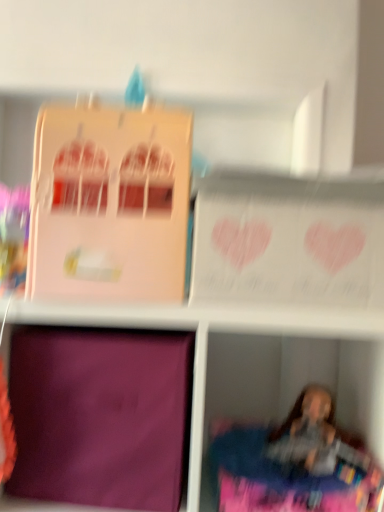
Where is `purple fabric at lower left`? This screenshot has width=384, height=512. purple fabric at lower left is located at coordinates (254, 360).

Measure the distance between purple matte cardboard box at lower left, the 1th cardboard box from the bottom, and camera.

purple matte cardboard box at lower left, the 1th cardboard box from the bottom, and camera are 29.09 inches apart from each other.

Identify the location of purple fabric at lower left. This screenshot has width=384, height=512. (254, 360).

Considering the sizes of purple fabric at lower left and purple matte cardboard box at lower left, the 2th cardboard box when ordered from top to bottom, in the image, is purple fabric at lower left taller or shorter than purple matte cardboard box at lower left, the 2th cardboard box when ordered from top to bottom,?

In the image, purple fabric at lower left appears to be taller than purple matte cardboard box at lower left, the 2th cardboard box when ordered from top to bottom.

From the image's perspective, is purple fabric at lower left above purple matte cardboard box at lower left, the 2th cardboard box when ordered from top to bottom?

Actually, purple fabric at lower left appears below purple matte cardboard box at lower left, the 2th cardboard box when ordered from top to bottom, in the image.

Is purple fabric at lower left looking in the opposite direction of purple matte cardboard box at lower left, the 1th cardboard box from the bottom?

That's right, purple fabric at lower left is facing away from purple matte cardboard box at lower left, the 1th cardboard box from the bottom.

From a real-world perspective, which is physically below, purple fabric at lower left or purple matte cardboard box at lower left, the 1th cardboard box from the bottom?

purple fabric at lower left.

Considering the sizes of pink matte cardboard box at upper left, which is counted as the second cardboard box, starting from the bottom, and purple fabric at lower left in the image, is pink matte cardboard box at upper left, which is counted as the second cardboard box, starting from the bottom, bigger or smaller than purple fabric at lower left?

In the image, pink matte cardboard box at upper left, which is counted as the second cardboard box, starting from the bottom, appears to be smaller than purple fabric at lower left.

Could you tell me if pink matte cardboard box at upper left, which is counted as the second cardboard box, starting from the bottom, is facing purple fabric at lower left?

No, pink matte cardboard box at upper left, which is counted as the second cardboard box, starting from the bottom, is not turned towards purple fabric at lower left.

From the image's perspective, which is above, pink matte cardboard box at upper left, the 1th cardboard box positioned from the top, or purple fabric at lower left?

pink matte cardboard box at upper left, the 1th cardboard box positioned from the top, appears higher in the image.

Does pink matte cardboard box at upper left, the 1th cardboard box positioned from the top, touch purple fabric at lower left?

pink matte cardboard box at upper left, the 1th cardboard box positioned from the top, and purple fabric at lower left are clearly separated.

Looking at this image, which of these two, purple matte cardboard box at lower left, the 1th cardboard box from the bottom, or pink matte cardboard box at upper left, which is counted as the second cardboard box, starting from the bottom, is smaller?

Smaller between the two is pink matte cardboard box at upper left, which is counted as the second cardboard box, starting from the bottom.

How many degrees apart are the facing directions of purple matte cardboard box at lower left, the 2th cardboard box when ordered from top to bottom, and pink matte cardboard box at upper left, the 1th cardboard box positioned from the top?

purple matte cardboard box at lower left, the 2th cardboard box when ordered from top to bottom, and pink matte cardboard box at upper left, the 1th cardboard box positioned from the top, are facing 3.01 degrees away from each other.

Identify the location of cardboard box above the purple matte cardboard box at lower left, the 1th cardboard box from the bottom (from the image's perspective). This screenshot has width=384, height=512. (109, 204).

How much distance is there between purple matte cardboard box at lower left, the 2th cardboard box when ordered from top to bottom, and pink matte cardboard box at upper left, the 1th cardboard box positioned from the top?

purple matte cardboard box at lower left, the 2th cardboard box when ordered from top to bottom, and pink matte cardboard box at upper left, the 1th cardboard box positioned from the top, are 9.37 inches apart.

Is purple fabric at lower left thinner than pink matte cardboard box at upper left, which is counted as the second cardboard box, starting from the bottom?

No, purple fabric at lower left is not thinner than pink matte cardboard box at upper left, which is counted as the second cardboard box, starting from the bottom.

This screenshot has width=384, height=512. Find the location of `the 2nd cardboard box directly above the purple fabric at lower left (from a real-world perspective)`. the 2nd cardboard box directly above the purple fabric at lower left (from a real-world perspective) is located at coordinates (109, 204).

Is purple fabric at lower left to the left or to the right of pink matte cardboard box at upper left, which is counted as the second cardboard box, starting from the bottom, in the image?

purple fabric at lower left is positioned on pink matte cardboard box at upper left, which is counted as the second cardboard box, starting from the bottom,'s right side.

Between point (181, 479) and point (360, 326), which one is positioned in front?

The point (360, 326) is more forward.

Is purple matte cardboard box at lower left, the 1th cardboard box from the bottom, facing away from purple fabric at lower left?

Absolutely, purple matte cardboard box at lower left, the 1th cardboard box from the bottom, is directed away from purple fabric at lower left.

You are a GUI agent. You are given a task and a screenshot of the screen. Output one action in this format:
    pyautogui.click(x=<x>, y=<y>)
    Task: Click on the shelf in front of the purple matte cardboard box at lower left, the 1th cardboard box from the bottom
    This screenshot has height=512, width=384.
    Given the screenshot: What is the action you would take?
    pyautogui.click(x=254, y=360)

Consider the image. Is pink matte cardboard box at upper left, the 1th cardboard box positioned from the top, not near purple matte cardboard box at lower left, the 1th cardboard box from the bottom?

That's not correct — pink matte cardboard box at upper left, the 1th cardboard box positioned from the top, is a little close to purple matte cardboard box at lower left, the 1th cardboard box from the bottom.

Identify the location of cardboard box above the purple matte cardboard box at lower left, the 2th cardboard box when ordered from top to bottom (from the image's perspective). coord(109,204).

Does point (91, 134) lie behind point (47, 455)?

No, (91, 134) is in front of (47, 455).

This screenshot has width=384, height=512. What are the coordinates of `the 1st cardboard box positioned above the purple fabric at lower left (from a real-world perspective)` in the screenshot? It's located at (100, 416).

In the image, there is a pink matte cardboard box at upper left, the 1th cardboard box positioned from the top. Identify the location of shelf below it (from the image's perspective). Image resolution: width=384 pixels, height=512 pixels. 254,360.

Considering their positions, is purple fabric at lower left positioned closer to purple matte cardboard box at lower left, the 2th cardboard box when ordered from top to bottom, than pink matte cardboard box at upper left, which is counted as the second cardboard box, starting from the bottom?

The object closer to purple matte cardboard box at lower left, the 2th cardboard box when ordered from top to bottom, is purple fabric at lower left.

Based on their spatial positions, is purple matte cardboard box at lower left, the 2th cardboard box when ordered from top to bottom, or purple fabric at lower left further from pink matte cardboard box at upper left, the 1th cardboard box positioned from the top?

purple fabric at lower left.

Looking at this image, estimate the real-world distances between objects in this image. Which object is further from purple fabric at lower left, purple matte cardboard box at lower left, the 2th cardboard box when ordered from top to bottom, or pink matte cardboard box at upper left, the 1th cardboard box positioned from the top?

pink matte cardboard box at upper left, the 1th cardboard box positioned from the top, is positioned further to the anchor purple fabric at lower left.

Estimate the real-world distances between objects in this image. Which object is further from pink matte cardboard box at upper left, the 1th cardboard box positioned from the top, purple fabric at lower left or purple matte cardboard box at lower left, the 2th cardboard box when ordered from top to bottom?

Based on the image, purple fabric at lower left appears to be further to pink matte cardboard box at upper left, the 1th cardboard box positioned from the top.

Looking at the image, which one is located further to purple fabric at lower left, pink matte cardboard box at upper left, which is counted as the second cardboard box, starting from the bottom, or purple matte cardboard box at lower left, the 1th cardboard box from the bottom?

pink matte cardboard box at upper left, which is counted as the second cardboard box, starting from the bottom.

From the image, which object appears to be nearer to purple matte cardboard box at lower left, the 1th cardboard box from the bottom, pink matte cardboard box at upper left, which is counted as the second cardboard box, starting from the bottom, or purple fabric at lower left?

Based on the image, purple fabric at lower left appears to be nearer to purple matte cardboard box at lower left, the 1th cardboard box from the bottom.

Where is `cardboard box between pink matte cardboard box at upper left, which is counted as the second cardboard box, starting from the bottom, and purple fabric at lower left vertically`? The width and height of the screenshot is (384, 512). cardboard box between pink matte cardboard box at upper left, which is counted as the second cardboard box, starting from the bottom, and purple fabric at lower left vertically is located at coordinates (100, 416).